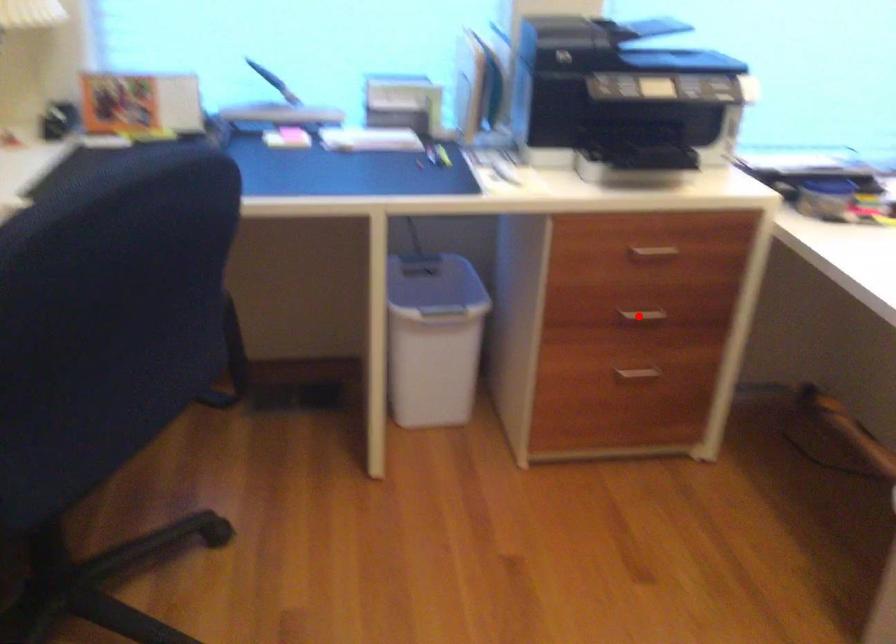
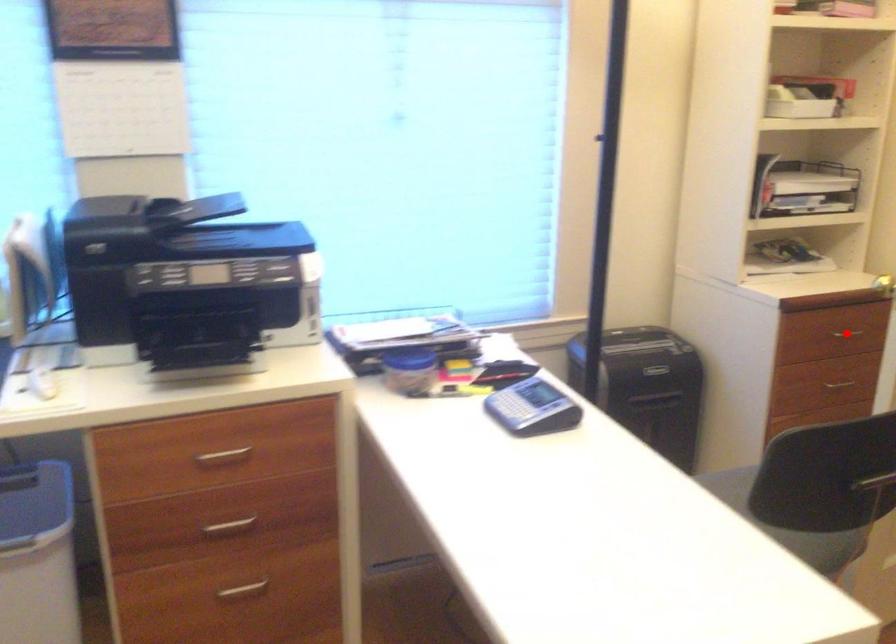
I am providing you with two images of the same scene from different viewpoints. A red point is marked on the first image and another point is marked on the second image. Do the highlighted points in image1 and image2 indicate the same real-world spot?

No